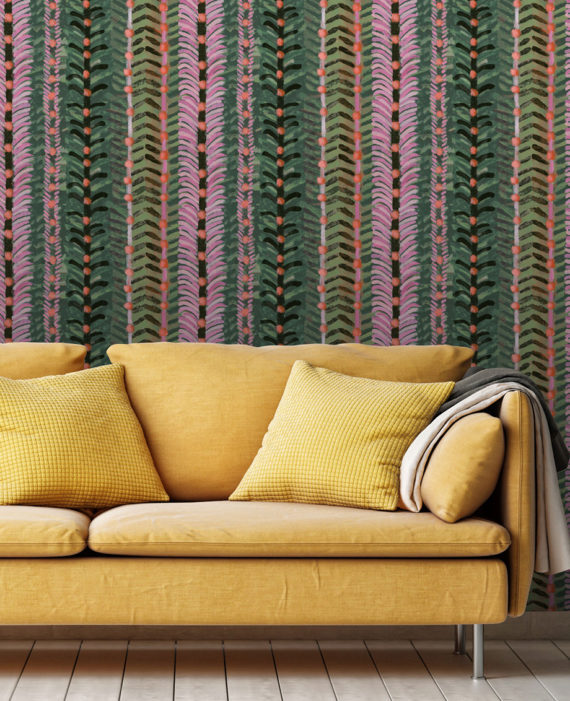
Where is `couch`? This screenshot has width=570, height=701. couch is located at coordinates (235, 423).